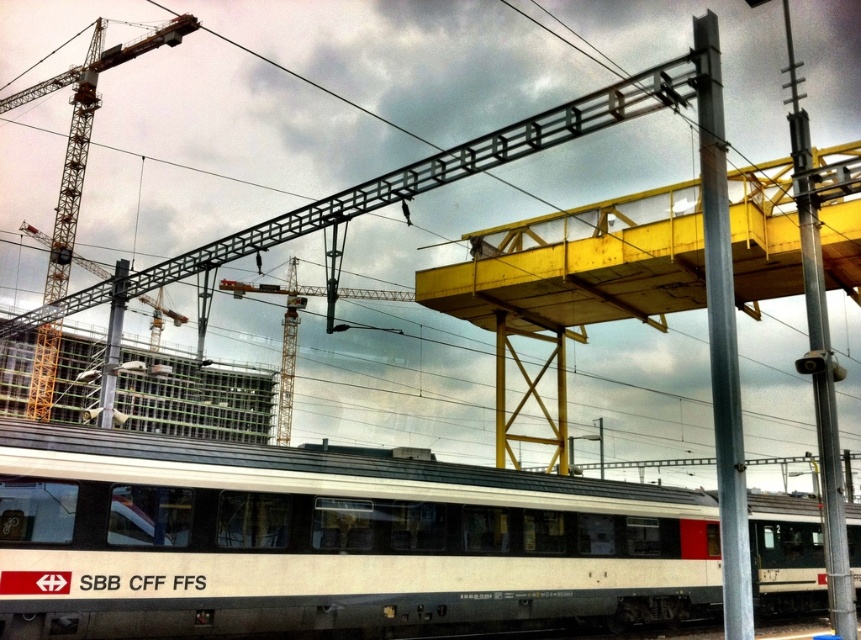
You are a construction worker standing on the yellow pedestrian bridge. You need to move a heavy tool from the metallic gray pole at center to the white matte passenger train at center. In which direction should you move the tool relative to the pole?

The white matte passenger train at center is to the left of the metallic gray pole at center, so you should move the tool to the left direction relative to the pole.

You are a construction worker who needs to place a safety barrier between the two metallic gray poles. Based on the scene, which pole should the barrier be placed closer to, the metallic gray pole at center or the metallic gray pole at right?

The metallic gray pole at center is positioned on the left side of the metallic gray pole at right, so the safety barrier should be placed closer to the metallic gray pole at right to ensure it is between them.

You are a construction worker standing near the train and need to inspect both the metallic gray pole at center and the metallic gray pole at right. Which pole should you check first if you want to start with the one that is nearest to you?

You should check the metallic gray pole at center first because it is closer to you than the metallic gray pole at right.